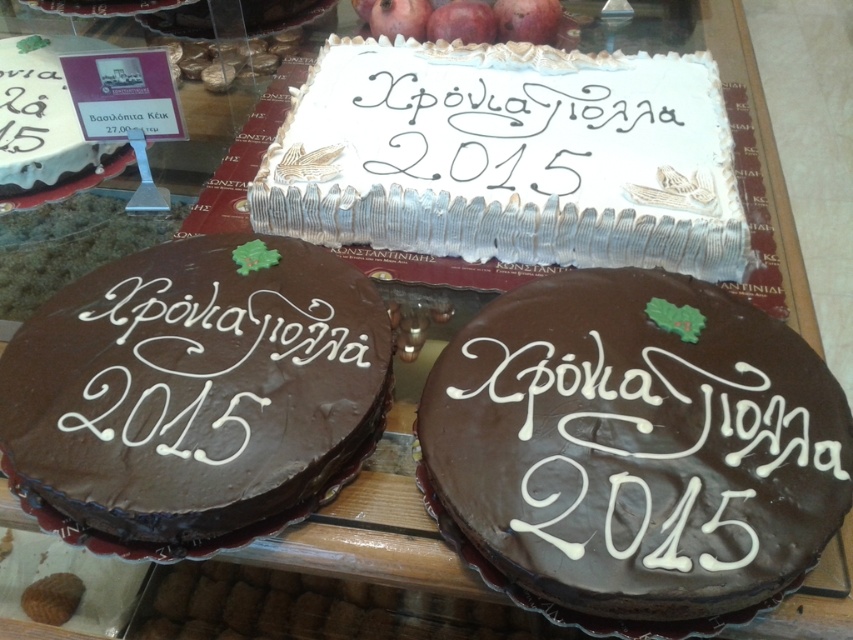
You are a customer at a bakery looking at the display. You see the white cream cake at center and the white matte cake at upper left. Which cake is positioned lower in the display?

The white cream cake at center is positioned below the white matte cake at upper left, so it is lower in the display.

You are a customer at the bakery and want to place an order for both the chocolatesmoothcake at center and the other cake with a white icing base and decorative border. The minimum distance required between two cakes during baking is 30 inches to prevent heat interference. Can you confirm if the current spacing between them meets the requirement?

The chocolatesmoothcake at center and the other cake with a white icing base and decorative border are 31.85 inches apart, which exceeds the minimum required distance of 30 inches. Therefore, the spacing meets the requirement to prevent heat interference.